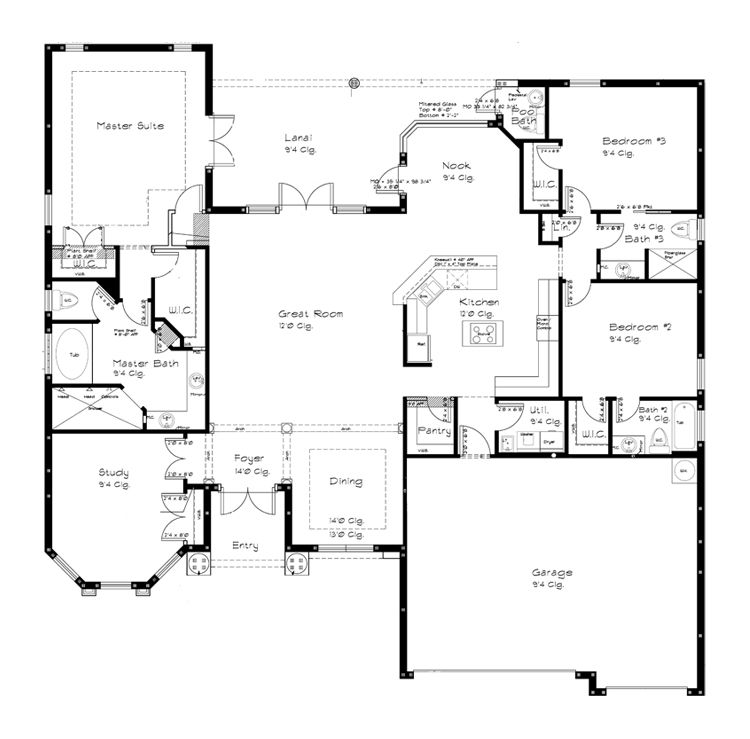
The height and width of the screenshot is (739, 750). Find the location of `bedroom`. bedroom is located at coordinates (117, 136), (632, 146), (621, 329), (614, 157).